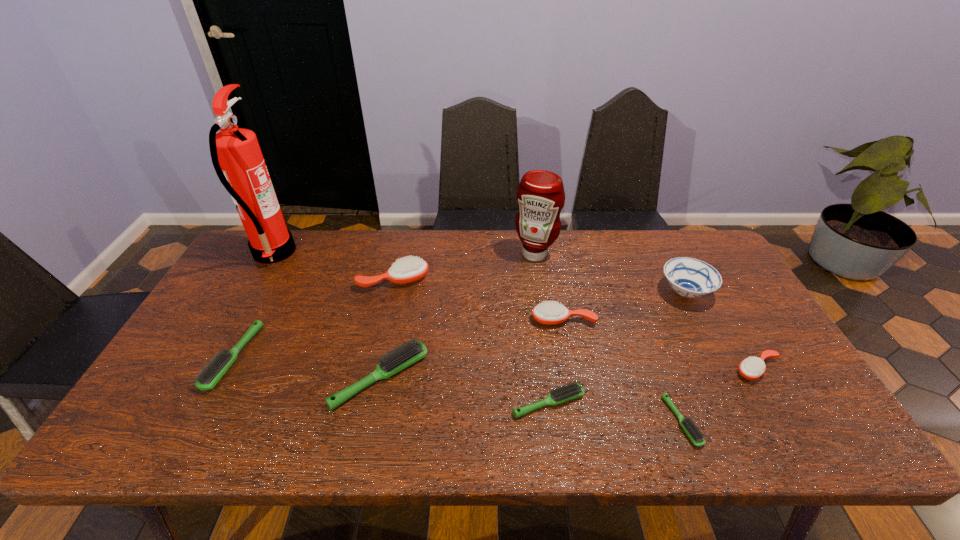
Locate an element on the screen. The image size is (960, 540). free space between the third light hairbrush from right to left and the smallest light hairbrush is located at coordinates (531, 400).

Where is `object that is the fourth closest to the biggest light hairbrush`? The image size is (960, 540). object that is the fourth closest to the biggest light hairbrush is located at coordinates (550, 313).

I want to click on the ninth closest object relative to the biggest light hairbrush, so click(751, 368).

Identify the location of hairbrush that is the fifth closest to the biggest light hairbrush. Image resolution: width=960 pixels, height=540 pixels. (695, 435).

Identify which hairbrush is the fifth closest to the eighth object from left to right. Please provide its 2D coordinates. Your answer should be formatted as a tuple, i.e. [(x, y)], where the tuple contains the x and y coordinates of a point satisfying the conditions above.

[(411, 269)]

You are a GUI agent. You are given a task and a screenshot of the screen. Output one action in this format:
    pyautogui.click(x=<x>, y=<y>)
    Task: Click on the orange hairbrush that is the second closest to the leftmost orange hairbrush
    
    Given the screenshot: What is the action you would take?
    pyautogui.click(x=751, y=368)

The width and height of the screenshot is (960, 540). I want to click on the third closest orange hairbrush relative to the fire extinguisher, so point(751,368).

Locate an element on the screen. light hairbrush that is the second closest to the tallest object is located at coordinates (411, 351).

Where is `the fourth closest light hairbrush to the tallest object`? The height and width of the screenshot is (540, 960). the fourth closest light hairbrush to the tallest object is located at coordinates (695, 435).

Find the location of a particular element. This screenshot has width=960, height=540. vacant space that satisfies the following two spatial constraints: 1. on the back side of the condiment; 2. on the right side of the leftmost light hairbrush is located at coordinates (288, 254).